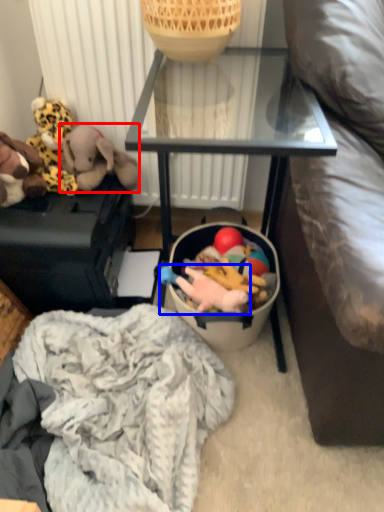
Question: Which object appears closest to the camera in this image, toy (highlighted by a red box) or toy (highlighted by a blue box)?

Choices:
 (A) toy
 (B) toy

Answer: (B)